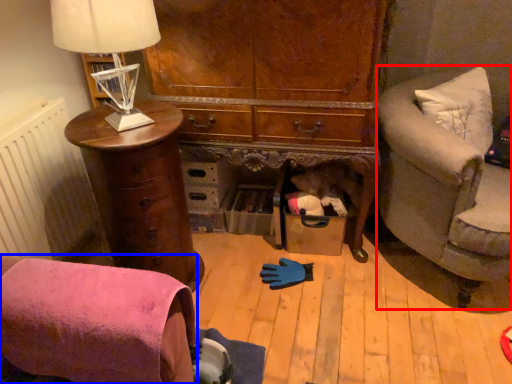
Question: Which of the following is the farthest to the observer, studio couch (highlighted by a red box) or chair (highlighted by a blue box)?

Choices:
 (A) studio couch
 (B) chair

Answer: (A)